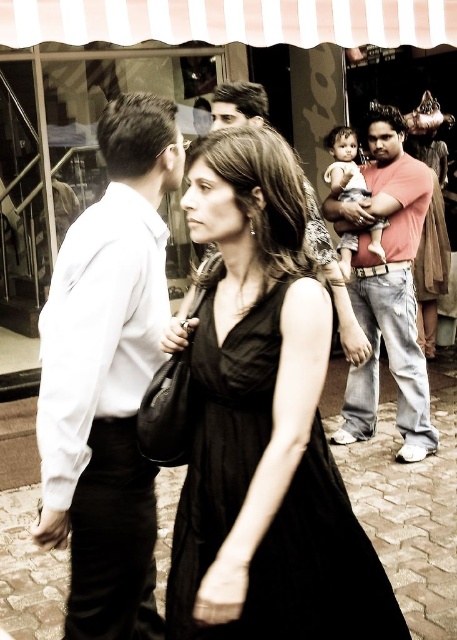
Does black fabric dress at center appear on the left side of soft pink fabric at center?

Yes, black fabric dress at center is to the left of soft pink fabric at center.

Which is behind, point (301, 241) or point (339, 264)?

Positioned behind is point (339, 264).

Describe the element at coordinates (262, 420) in the screenshot. The image size is (457, 640). I see `black fabric dress at center` at that location.

Identify the location of black fabric dress at center. Image resolution: width=457 pixels, height=640 pixels. (262, 420).

I want to click on black satin dress at center, so click(276, 509).

Is black satin dress at center to the right of matte pink shirt at center from the viewer's perspective?

No, black satin dress at center is not to the right of matte pink shirt at center.

Which is in front, point (304, 628) or point (391, 176)?

Point (304, 628)

The height and width of the screenshot is (640, 457). Identify the location of black satin dress at center. (276, 509).

Which is more to the left, black fabric dress at center or white shirt at left?

white shirt at left

Who is taller, black fabric dress at center or white shirt at left?

Standing taller between the two is white shirt at left.

In order to click on black fabric dress at center in this screenshot , I will do `click(262, 420)`.